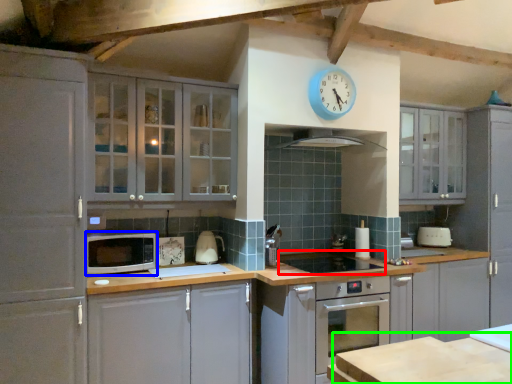
Question: Which object is the farthest from appliance (highlighted by a red box)? Choose among these: microwave oven (highlighted by a blue box) or table (highlighted by a green box).

Choices:
 (A) microwave oven
 (B) table

Answer: (B)